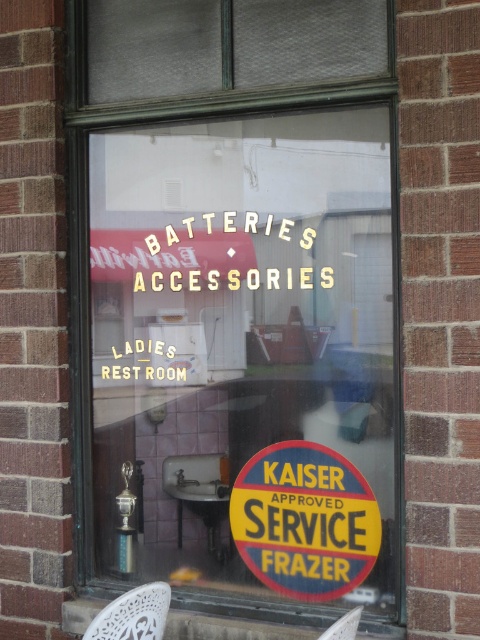
You are standing outside the store looking through the window. You see two chairs inside the restroom area reflected in the window glass. Which chair is closer to the left side of the window? The chairs are the white lace chair at lower left and the white plastic chair at lower right.

The white lace chair at lower left is closer to the left side of the window because it is positioned to the left of the white plastic chair at lower right.

You are standing in front of the storefront window and notice two points marked on the reflection of the restroom area. The first point is at coordinates point (303, 550) and the second is at point (348, 611). Which point is closer to your eyes?

Point (303, 550) is further to the camera than point (348, 611), so the point closer to your eyes is point (348, 611).